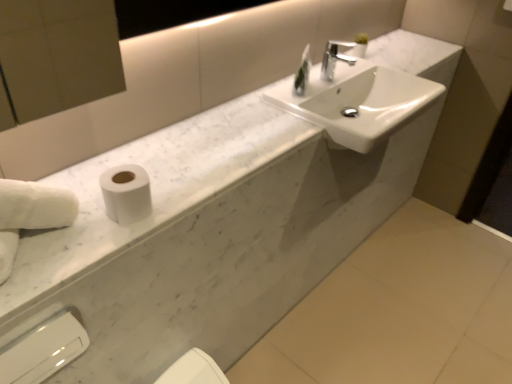
What do you see at coordinates (303, 73) in the screenshot? I see `clear glass soap dispenser at upper center` at bounding box center [303, 73].

In order to click on white glossy sink at upper center in this screenshot , I will do `click(358, 102)`.

Describe the element at coordinates (151, 191) in the screenshot. The image size is (512, 384). I see `white marble counter top at center` at that location.

What do you see at coordinates (126, 193) in the screenshot?
I see `white matte toilet paper at left` at bounding box center [126, 193].

What is the approximate height of white plastic hand dryer at lower left?

white plastic hand dryer at lower left is 18.18 centimeters in height.

Measure the distance between white plastic hand dryer at lower left and camera.

white plastic hand dryer at lower left and camera are 3.50 feet apart from each other.

In order to click on white fluffy hand towel at left in this screenshot , I will do `click(30, 214)`.

Is white matte toilet paper at left at the back of chrome metallic faucet at upper center?

chrome metallic faucet at upper center does not have its back to white matte toilet paper at left.

Considering the relative sizes of chrome metallic faucet at upper center and white matte toilet paper at left in the image provided, is chrome metallic faucet at upper center wider than white matte toilet paper at left?

Correct, the width of chrome metallic faucet at upper center exceeds that of white matte toilet paper at left.

Which of these two, chrome metallic faucet at upper center or white matte toilet paper at left, stands shorter?

white matte toilet paper at left.

From a real-world perspective, is chrome metallic faucet at upper center positioned under white matte toilet paper at left based on gravity?

Actually, chrome metallic faucet at upper center is physically above white matte toilet paper at left in the real world.

Is white matte toilet paper at left not near white plastic hand dryer at lower left?

Actually, white matte toilet paper at left and white plastic hand dryer at lower left are a little close together.

Between white matte toilet paper at left and white plastic hand dryer at lower left, which one has larger size?

Bigger between the two is white plastic hand dryer at lower left.

From a real-world perspective, is white matte toilet paper at left above or below white plastic hand dryer at lower left?

white matte toilet paper at left is situated higher than white plastic hand dryer at lower left in the real world.

Considering the sizes of white marble counter top at center and clear glass soap dispenser at upper center in the image, is white marble counter top at center taller or shorter than clear glass soap dispenser at upper center?

Clearly, white marble counter top at center is shorter compared to clear glass soap dispenser at upper center.

Between white marble counter top at center and clear glass soap dispenser at upper center, which one is positioned behind?

clear glass soap dispenser at upper center.

Identify the location of soap dispenser above the white marble counter top at center (from a real-world perspective). (303, 73).

From a real-world perspective, between white marble counter top at center and clear glass soap dispenser at upper center, who is vertically lower?

In real-world perspective, white marble counter top at center is lower.

Would you say chrome metallic faucet at upper center is a long distance from white marble counter top at center?

Actually, chrome metallic faucet at upper center and white marble counter top at center are a little close together.

Is point (329, 54) closer or farther from the camera than point (169, 149)?

Clearly, point (329, 54) is more distant from the camera than point (169, 149).

From a real-world perspective, is chrome metallic faucet at upper center positioned above or below white marble counter top at center?

From a real-world perspective, chrome metallic faucet at upper center is physically above white marble counter top at center.

Consider the image. Is chrome metallic faucet at upper center not inside white marble counter top at center?

Yes.

Considering the positions of point (168, 383) and point (305, 64), is point (168, 383) closer or farther from the camera than point (305, 64)?

Point (168, 383) is positioned closer to the camera compared to point (305, 64).

Is white glossy bidet at lower center spatially inside clear glass soap dispenser at upper center, or outside of it?

white glossy bidet at lower center cannot be found inside clear glass soap dispenser at upper center.

From a real-world perspective, which is physically below, white glossy bidet at lower center or clear glass soap dispenser at upper center?

white glossy bidet at lower center, from a real-world perspective.

Considering the sizes of objects white fluffy hand towel at left and white marble counter top at center in the image provided, who is thinner, white fluffy hand towel at left or white marble counter top at center?

white fluffy hand towel at left.

Image resolution: width=512 pixels, height=384 pixels. I want to click on counter top that is under the white fluffy hand towel at left (from a real-world perspective), so point(151,191).

Considering the sizes of white fluffy hand towel at left and white marble counter top at center in the image, is white fluffy hand towel at left taller or shorter than white marble counter top at center?

In the image, white fluffy hand towel at left appears to be taller than white marble counter top at center.

Does clear glass soap dispenser at upper center appear on the right side of chrome metallic faucet at upper center?

No.

Is clear glass soap dispenser at upper center in contact with chrome metallic faucet at upper center?

No, clear glass soap dispenser at upper center is not making contact with chrome metallic faucet at upper center.

From a real-world perspective, is clear glass soap dispenser at upper center on top of chrome metallic faucet at upper center?

No, from a real-world perspective, clear glass soap dispenser at upper center is not above chrome metallic faucet at upper center.

Is clear glass soap dispenser at upper center surrounding chrome metallic faucet at upper center?

No.

This screenshot has width=512, height=384. Find the location of `toilet paper on the left of chrome metallic faucet at upper center`. toilet paper on the left of chrome metallic faucet at upper center is located at coordinates (126, 193).

The height and width of the screenshot is (384, 512). Identify the location of hand dryer below the white matte toilet paper at left (from the image's perspective). (44, 350).

Which object lies further to the anchor point white glossy sink at upper center, white plastic hand dryer at lower left or white matte toilet paper at left?

white plastic hand dryer at lower left is positioned further to the anchor white glossy sink at upper center.

Based on their spatial positions, is white marble counter top at center or white glossy sink at upper center further from white glossy bidet at lower center?

The object further to white glossy bidet at lower center is white glossy sink at upper center.

Considering their positions, is clear glass soap dispenser at upper center positioned further to white fluffy hand towel at left than white plastic hand dryer at lower left?

Based on the image, clear glass soap dispenser at upper center appears to be further to white fluffy hand towel at left.

Looking at the image, which one is located further to white fluffy hand towel at left, clear glass soap dispenser at upper center or white glossy sink at upper center?

white glossy sink at upper center is positioned further to the anchor white fluffy hand towel at left.

Based on the photo, when comparing their distances from white glossy sink at upper center, does white matte toilet paper at left or chrome metallic faucet at upper center seem closer?

chrome metallic faucet at upper center is positioned closer to the anchor white glossy sink at upper center.

From the picture: From the image, which object appears to be nearer to white marble counter top at center, chrome metallic faucet at upper center or white matte toilet paper at left?

white matte toilet paper at left.

Estimate the real-world distances between objects in this image. Which object is further from white plastic hand dryer at lower left, white matte toilet paper at left or clear glass soap dispenser at upper center?

Among the two, clear glass soap dispenser at upper center is located further to white plastic hand dryer at lower left.

Based on their spatial positions, is white marble counter top at center or white glossy sink at upper center closer to clear glass soap dispenser at upper center?

Result: white glossy sink at upper center is positioned closer to the anchor clear glass soap dispenser at upper center.

Where is `toilet paper located between white fluffy hand towel at left and clear glass soap dispenser at upper center in the depth direction`? toilet paper located between white fluffy hand towel at left and clear glass soap dispenser at upper center in the depth direction is located at coordinates (126, 193).

Where is `hand dryer between white fluffy hand towel at left and white marble counter top at center`? hand dryer between white fluffy hand towel at left and white marble counter top at center is located at coordinates (44, 350).

The image size is (512, 384). Find the location of `soap dispenser positioned between white glossy sink at upper center and chrome metallic faucet at upper center from near to far`. soap dispenser positioned between white glossy sink at upper center and chrome metallic faucet at upper center from near to far is located at coordinates (303, 73).

Where is `soap dispenser positioned between white marble counter top at center and chrome metallic faucet at upper center from near to far`? soap dispenser positioned between white marble counter top at center and chrome metallic faucet at upper center from near to far is located at coordinates [x=303, y=73].